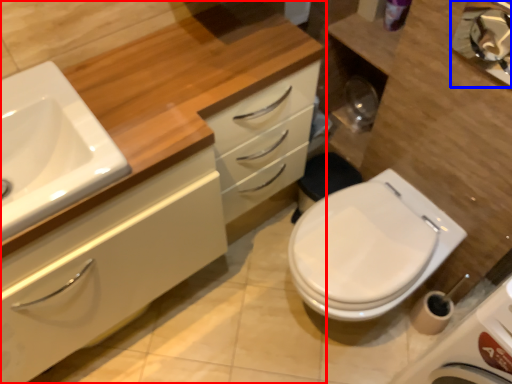
Question: Which object is further to the camera taking this photo, bathroom cabinet (highlighted by a red box) or mirror (highlighted by a blue box)?

Choices:
 (A) bathroom cabinet
 (B) mirror

Answer: (B)